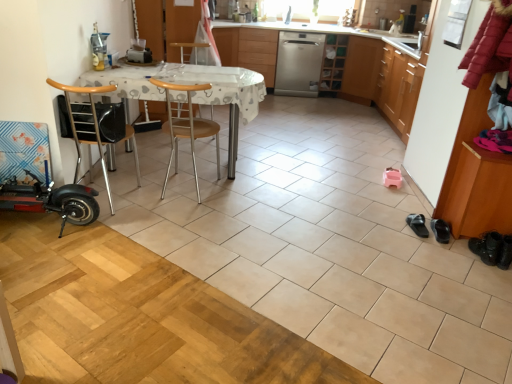
Find the location of a particular element. black leather shoes at lower right, acting as the 2th footwear starting from the left is located at coordinates (440, 230).

What is the approximate width of white plastic table at center?

It is 30.46 inches.

In order to click on silver metallic dishwasher at center, acting as the second cabinetry starting from the front in this screenshot , I will do `click(259, 52)`.

Image resolution: width=512 pixels, height=384 pixels. Describe the element at coordinates (259, 52) in the screenshot. I see `silver metallic dishwasher at center, the 1th cabinetry viewed from the left` at that location.

What is the approximate width of wooden at center, the first chair viewed from the right?

19.22 inches.

This screenshot has width=512, height=384. In order to click on black leather shoes at lower right, which appears as the second footwear when viewed from the right in this screenshot , I will do `click(440, 230)`.

Image resolution: width=512 pixels, height=384 pixels. I want to click on dish washer above the black leather shoe at lower right, marked as the 1th footwear in a left-to-right arrangement (from a real-world perspective), so click(x=298, y=64).

Relative to black leather shoe at lower right, which is the third footwear from right to left, is satin silver dishwasher at center in front or behind?

In the image, satin silver dishwasher at center appears behind black leather shoe at lower right, which is the third footwear from right to left.

Looking at this image, would you say wooden at center, the 2th chair in the left-to-right sequence, contains wooden chair at left, which appears as the second chair when viewed from the right?

No, wooden chair at left, which appears as the second chair when viewed from the right, is not a part of wooden at center, the 2th chair in the left-to-right sequence.

Is wooden at center, the first chair viewed from the right, in front of wooden chair at left, the first chair positioned from the left?

No.

From their relative heights in the image, would you say wooden at center, the 2th chair in the left-to-right sequence, is taller or shorter than wooden chair at left, the first chair positioned from the left?

wooden at center, the 2th chair in the left-to-right sequence, is taller than wooden chair at left, the first chair positioned from the left.

From the image's perspective, which is below, black leather shoes at lower right, which appears as the second footwear when viewed from the right, or wooden chair at left, which appears as the second chair when viewed from the right?

black leather shoes at lower right, which appears as the second footwear when viewed from the right, appears lower in the image.

From a real-world perspective, is black leather shoes at lower right, acting as the 2th footwear starting from the left, positioned above or below wooden chair at left, the first chair positioned from the left?

From a real-world perspective, black leather shoes at lower right, acting as the 2th footwear starting from the left, is physically below wooden chair at left, the first chair positioned from the left.

Which is correct: black leather shoes at lower right, which appears as the second footwear when viewed from the right, is inside wooden chair at left, which appears as the second chair when viewed from the right, or outside of it?

black leather shoes at lower right, which appears as the second footwear when viewed from the right, is not enclosed by wooden chair at left, which appears as the second chair when viewed from the right.

Does black leather shoe at lower right, which is the third footwear from right to left, have a greater height compared to wooden at center, the 2th chair in the left-to-right sequence?

No.

Considering the points (415, 221) and (156, 83), which point is in front, point (415, 221) or point (156, 83)?

Point (415, 221)

Consider the image. Are black leather shoe at lower right, which is the third footwear from right to left, and wooden at center, the first chair viewed from the right, located far from each other?

Indeed, black leather shoe at lower right, which is the third footwear from right to left, is not near wooden at center, the first chair viewed from the right.

Looking at their sizes, would you say black leather shoe at lower right, marked as the 1th footwear in a left-to-right arrangement, is wider or thinner than wooden at center, the 2th chair in the left-to-right sequence?

Considering their sizes, black leather shoe at lower right, marked as the 1th footwear in a left-to-right arrangement, looks slimmer than wooden at center, the 2th chair in the left-to-right sequence.

Measure the distance between black leather shoe at lower right, marked as the 1th footwear in a left-to-right arrangement, and satin silver dishwasher at center.

black leather shoe at lower right, marked as the 1th footwear in a left-to-right arrangement, and satin silver dishwasher at center are 3.25 meters apart from each other.

Is black leather shoe at lower right, marked as the 1th footwear in a left-to-right arrangement, oriented towards satin silver dishwasher at center?

No, black leather shoe at lower right, marked as the 1th footwear in a left-to-right arrangement, does not turn towards satin silver dishwasher at center.

You are a GUI agent. You are given a task and a screenshot of the screen. Output one action in this format:
    pyautogui.click(x=<x>, y=<y>)
    Task: Click on the dish washer lying behind the black leather shoe at lower right, marked as the 1th footwear in a left-to-right arrangement
    
    Given the screenshot: What is the action you would take?
    pyautogui.click(x=298, y=64)

Does point (421, 237) appear closer or farther from the camera than point (306, 70)?

Point (421, 237) is closer to the camera than point (306, 70).

Is black leather shoe at lower right, which is the third footwear from right to left, completely or partially outside of wooden chair at left, which appears as the second chair when viewed from the right?

Yes, black leather shoe at lower right, which is the third footwear from right to left, is located beyond the bounds of wooden chair at left, which appears as the second chair when viewed from the right.

How much distance is there between black leather shoe at lower right, which is the third footwear from right to left, and wooden chair at left, which appears as the second chair when viewed from the right?

They are 7.04 feet apart.

Considering the relative positions of black leather shoe at lower right, which is the third footwear from right to left, and wooden chair at left, which appears as the second chair when viewed from the right, in the image provided, is black leather shoe at lower right, which is the third footwear from right to left, to the left or to the right of wooden chair at left, which appears as the second chair when viewed from the right,?

black leather shoe at lower right, which is the third footwear from right to left, is to the right of wooden chair at left, which appears as the second chair when viewed from the right.

From a real-world perspective, is black leather shoe at lower right, which is the third footwear from right to left, under wooden chair at left, which appears as the second chair when viewed from the right?

Indeed, from a real-world perspective, black leather shoe at lower right, which is the third footwear from right to left, is positioned beneath wooden chair at left, which appears as the second chair when viewed from the right.

From a real-world perspective, which is physically below, black leather shoes at lower right, which appears as the second footwear when viewed from the right, or brown wood shoe rack at right, the 2th cabinetry viewed from the top?

From a 3D spatial view, black leather shoes at lower right, which appears as the second footwear when viewed from the right, is below.

Which of these two, black leather shoes at lower right, acting as the 2th footwear starting from the left, or brown wood shoe rack at right, arranged as the second cabinetry when viewed from the left, is thinner?

With smaller width is black leather shoes at lower right, acting as the 2th footwear starting from the left.

In the image, is black leather shoes at lower right, which appears as the second footwear when viewed from the right, on the left side or the right side of brown wood shoe rack at right, positioned as the 1th cabinetry in front-to-back order?

In the image, black leather shoes at lower right, which appears as the second footwear when viewed from the right, appears on the left side of brown wood shoe rack at right, positioned as the 1th cabinetry in front-to-back order.

The height and width of the screenshot is (384, 512). What are the coordinates of `dish washer above the black leather shoe at lower right, marked as the 1th footwear in a left-to-right arrangement (from a real-world perspective)` in the screenshot? It's located at pyautogui.click(x=298, y=64).

I want to click on chair lying behind the wooden chair at left, which appears as the second chair when viewed from the right, so click(186, 127).

Estimate the real-world distances between objects in this image. Which object is closer to satin silver dishwasher at center, wooden at center, the 2th chair in the left-to-right sequence, or black leather shoes at lower right, which appears as the second footwear when viewed from the right?

wooden at center, the 2th chair in the left-to-right sequence, is closer to satin silver dishwasher at center.

Looking at the image, which one is located further to black leather boots at lower right, the 1th footwear in the right-to-left sequence, silver metallic dishwasher at center, which appears as the first cabinetry when viewed from the back, or white plastic table at center?

The object further to black leather boots at lower right, the 1th footwear in the right-to-left sequence, is silver metallic dishwasher at center, which appears as the first cabinetry when viewed from the back.

Which object lies nearer to the anchor point satin silver dishwasher at center, white plastic table at center or brown wood shoe rack at right, positioned as the 1th cabinetry in front-to-back order?

white plastic table at center is positioned closer to the anchor satin silver dishwasher at center.

When comparing their distances from wooden at center, the first chair viewed from the right, does silver metallic dishwasher at center, the 1th cabinetry viewed from the left, or wooden chair at left, which appears as the second chair when viewed from the right, seem further?

silver metallic dishwasher at center, the 1th cabinetry viewed from the left, is further to wooden at center, the first chair viewed from the right.

Looking at the image, which one is located closer to brown wood shoe rack at right, which is the 1th cabinetry from bottom to top, black leather shoe at lower right, marked as the 1th footwear in a left-to-right arrangement, or satin silver dishwasher at center?

Among the two, black leather shoe at lower right, marked as the 1th footwear in a left-to-right arrangement, is located nearer to brown wood shoe rack at right, which is the 1th cabinetry from bottom to top.

Looking at the image, which one is located closer to brown wood shoe rack at right, the second cabinetry when ordered from back to front, black leather shoes at lower right, acting as the 2th footwear starting from the left, or black leather boots at lower right, which is the third footwear from left to right?

black leather boots at lower right, which is the third footwear from left to right.

Looking at the image, which one is located closer to white plastic table at center, wooden chair at left, which appears as the second chair when viewed from the right, or black leather shoe at lower right, marked as the 1th footwear in a left-to-right arrangement?

wooden chair at left, which appears as the second chair when viewed from the right, lies closer to white plastic table at center than the other object.

Looking at the image, which one is located closer to wooden at center, the 2th chair in the left-to-right sequence, satin silver dishwasher at center or white plastic table at center?

The object closer to wooden at center, the 2th chair in the left-to-right sequence, is white plastic table at center.

In order to click on desk between wooden chair at left, which appears as the second chair when viewed from the right, and brown wood shoe rack at right, arranged as the second cabinetry when viewed from the left, from left to right in this screenshot , I will do `click(193, 93)`.

Locate an element on the screen. This screenshot has width=512, height=384. footwear located between black leather boots at lower right, the 1th footwear in the right-to-left sequence, and black leather shoe at lower right, marked as the 1th footwear in a left-to-right arrangement, in the depth direction is located at coordinates (440, 230).

I want to click on cabinetry between white plastic table at center and satin silver dishwasher at center along the z-axis, so click(x=259, y=52).

Locate an element on the screen. This screenshot has width=512, height=384. desk between wooden chair at left, the first chair positioned from the left, and satin silver dishwasher at center from front to back is located at coordinates pyautogui.click(x=193, y=93).